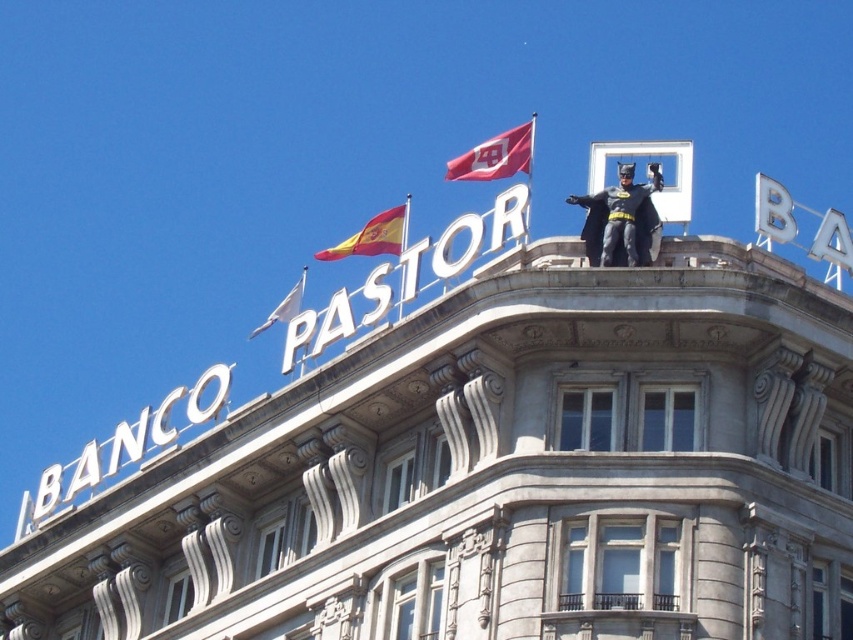
Does smooth black costume at upper center have a greater width compared to red fabric flag at upper center?

Incorrect, smooth black costume at upper center's width does not surpass red fabric flag at upper center's.

Identify the location of smooth black costume at upper center. Image resolution: width=853 pixels, height=640 pixels. (621, 220).

Is red fabric flag at upper center thinner than yellow-red striped fabric at upper center?

Yes.

Based on the photo, between red fabric flag at upper center and yellow-red striped fabric at upper center, which one has less height?

yellow-red striped fabric at upper center

Measure the distance between point [515,160] and camera.

Point [515,160] and camera are 55.96 meters apart.

Find the location of a particular element. This screenshot has height=640, width=853. red fabric flag at upper center is located at coordinates (495, 156).

Is smooth black costume at upper center to the left of yellow-red striped fabric at upper center from the viewer's perspective?

Incorrect, smooth black costume at upper center is not on the left side of yellow-red striped fabric at upper center.

This screenshot has height=640, width=853. Describe the element at coordinates (621, 220) in the screenshot. I see `smooth black costume at upper center` at that location.

The width and height of the screenshot is (853, 640). Describe the element at coordinates (621, 220) in the screenshot. I see `smooth black costume at upper center` at that location.

You are a GUI agent. You are given a task and a screenshot of the screen. Output one action in this format:
    pyautogui.click(x=<x>, y=<y>)
    Task: Click on the smooth black costume at upper center
    
    Given the screenshot: What is the action you would take?
    pyautogui.click(x=621, y=220)